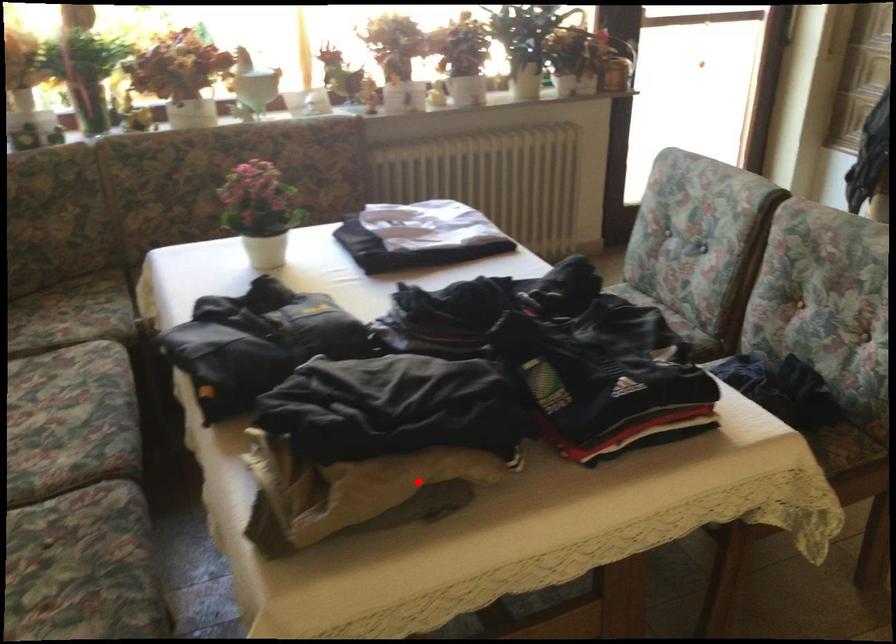
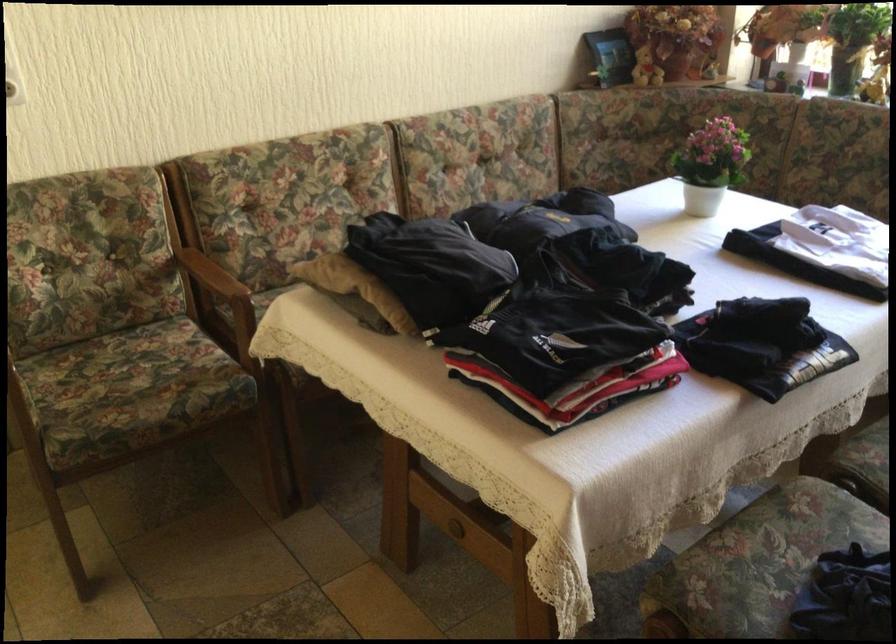
Find the pixel in the second image that matches the highlighted location in the first image.

(355, 287)